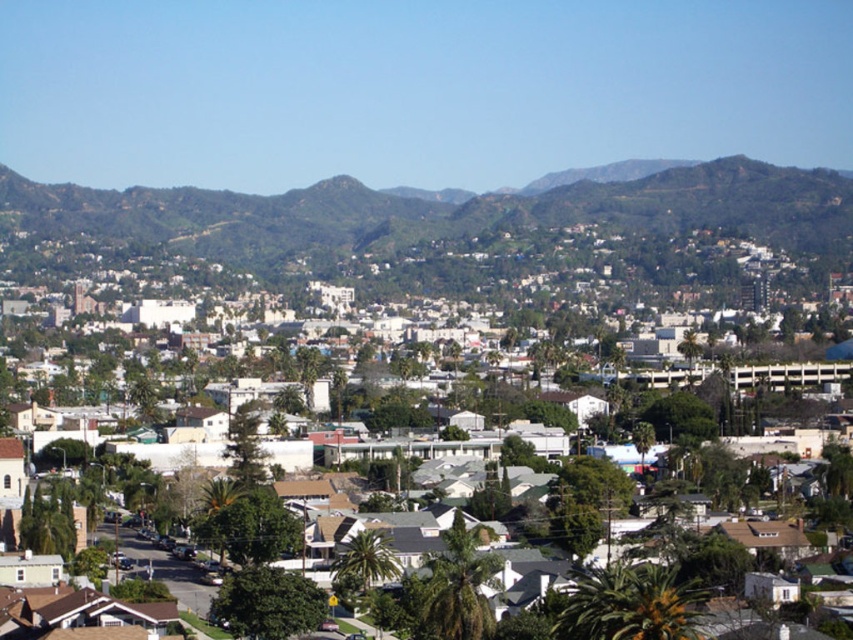
Question: Considering the relative positions of green textured hillside at upper center and green leafy palm tree at center in the image provided, where is green textured hillside at upper center located with respect to green leafy palm tree at center?

Choices:
 (A) above
 (B) below

Answer: (A)

Question: Can you confirm if white matte houses at center is positioned to the left of green leafy palm tree at center?

Choices:
 (A) no
 (B) yes

Answer: (B)

Question: Which of these objects is positioned farthest from the green leafy palm tree at center?

Choices:
 (A) white matte houses at center
 (B) green textured hillside at upper center

Answer: (B)

Question: Which point is closer to the camera?

Choices:
 (A) green leafy palm tree at center
 (B) green leafy palm tree at lower left
 (C) green textured hillside at upper center

Answer: (A)

Question: Which point is farther to the camera?

Choices:
 (A) (218, 550)
 (B) (202, 244)
 (C) (367, 566)
 (D) (508, 340)

Answer: (B)

Question: Where is green leafy palm tree at center located in relation to green leafy palm tree at lower left in the image?

Choices:
 (A) right
 (B) left

Answer: (A)